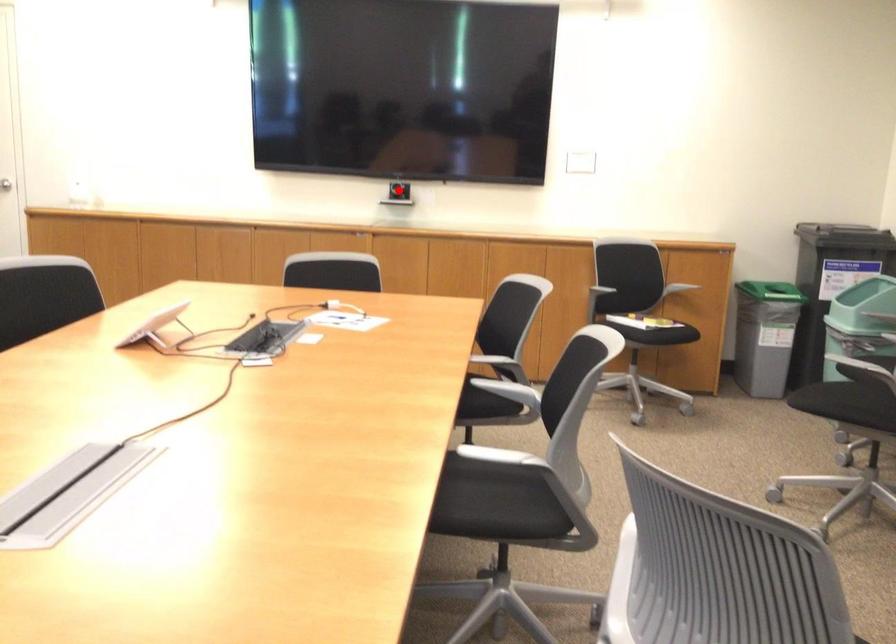
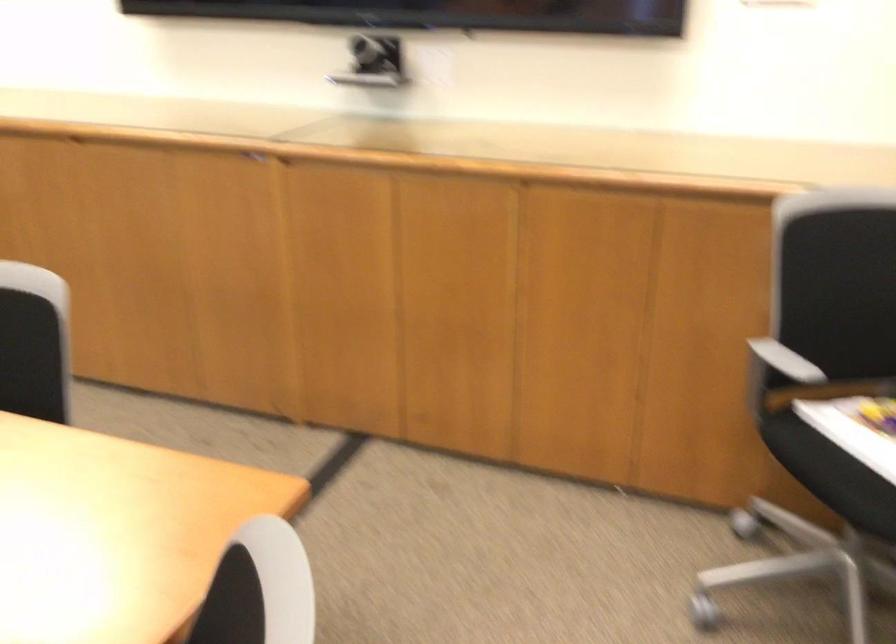
Question: I am providing you with two images of the same scene from different viewpoints. A red point is marked on the first image. Is the red point's position out of view in image 2?

Choices:
 (A) Yes
 (B) No

Answer: (A)